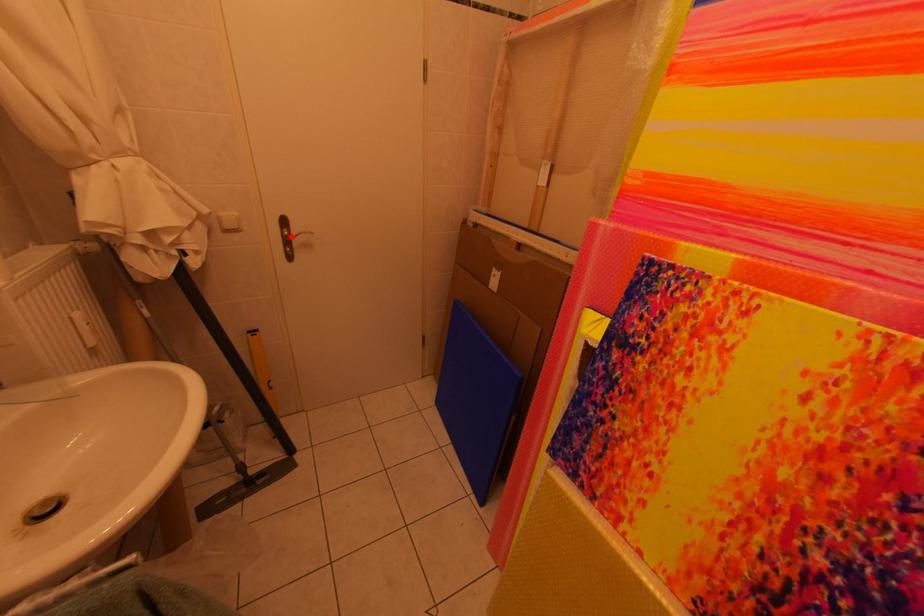
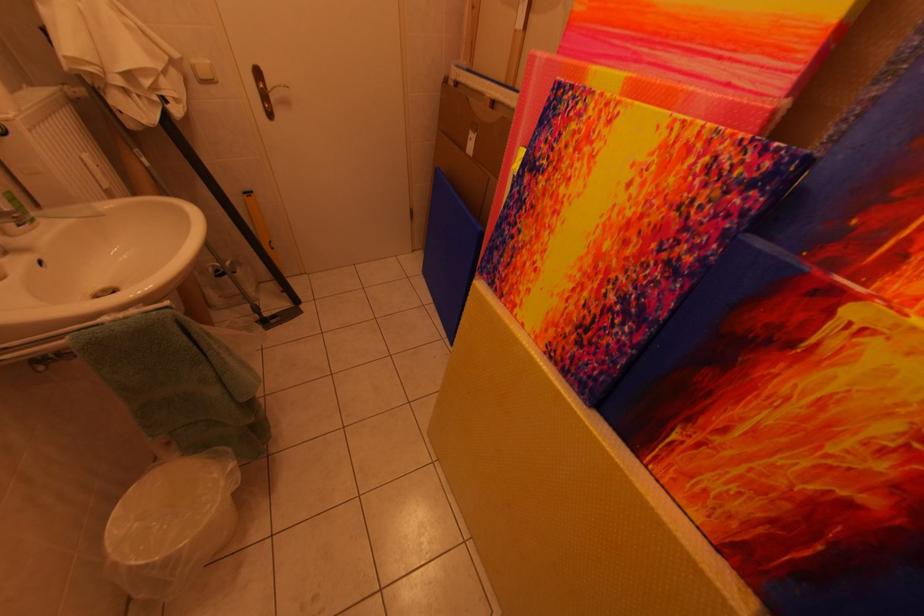
Where in the second image is the point corresponding to the highlighted location from the first image?

(268, 91)